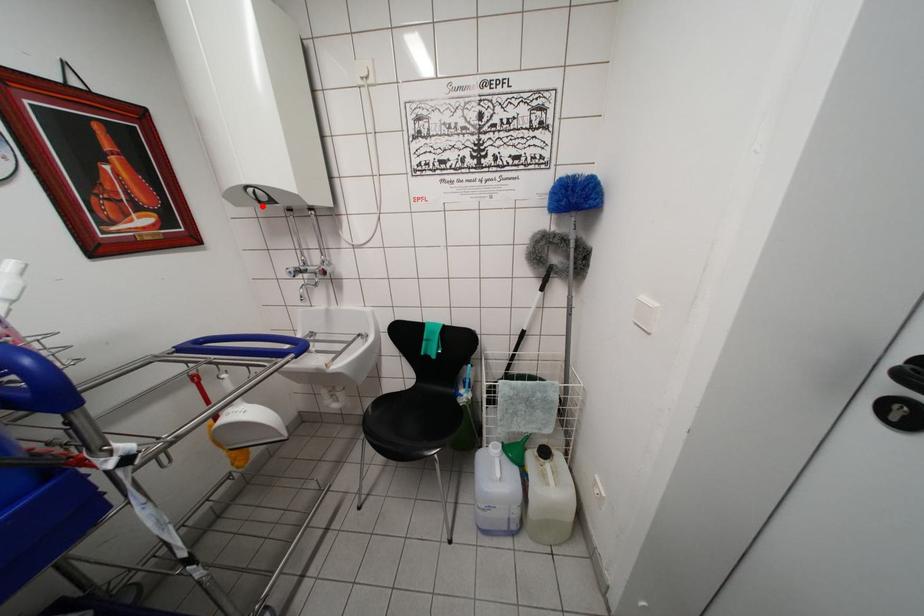
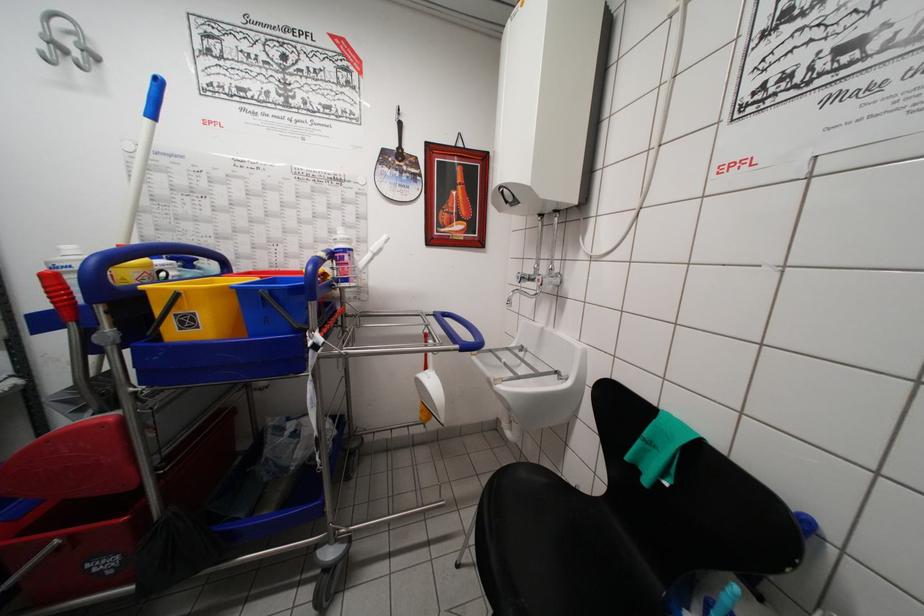
Locate, in the second image, the point that corresponds to the highlighted location in the first image.

(511, 207)